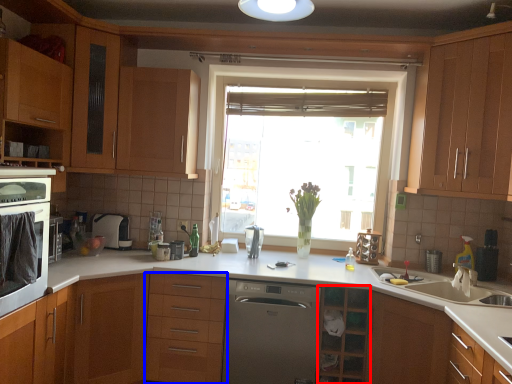
Question: Which point is further to the camera, cabinetry (highlighted by a red box) or drawer (highlighted by a blue box)?

Choices:
 (A) cabinetry
 (B) drawer

Answer: (B)